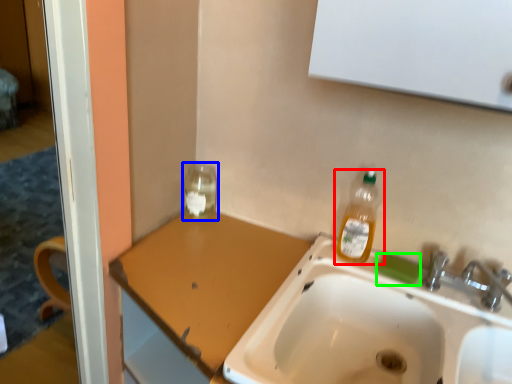
Question: Based on their relative distances, which object is farther from bottle (highlighted by a red box)? Choose from glass jar (highlighted by a blue box) and soap (highlighted by a green box).

Choices:
 (A) glass jar
 (B) soap

Answer: (A)